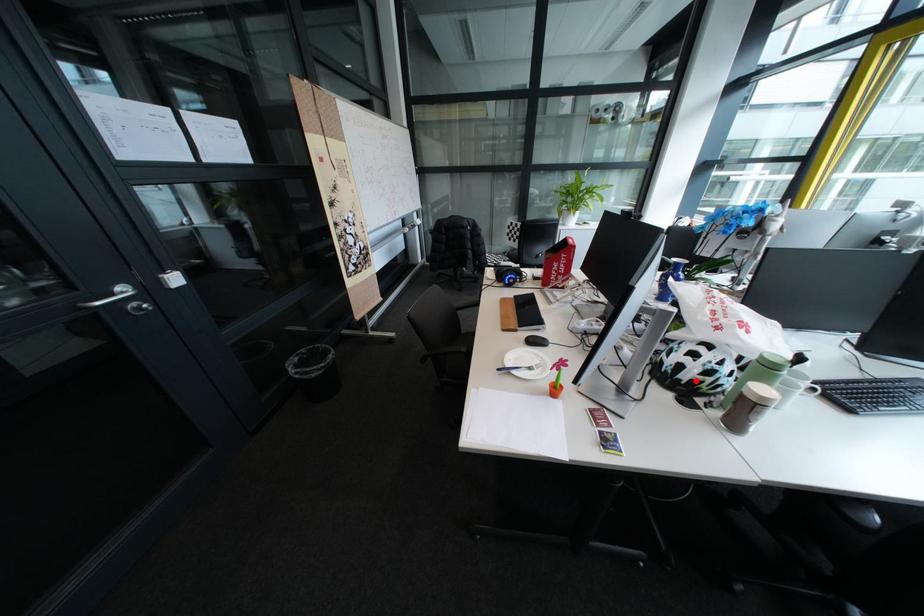
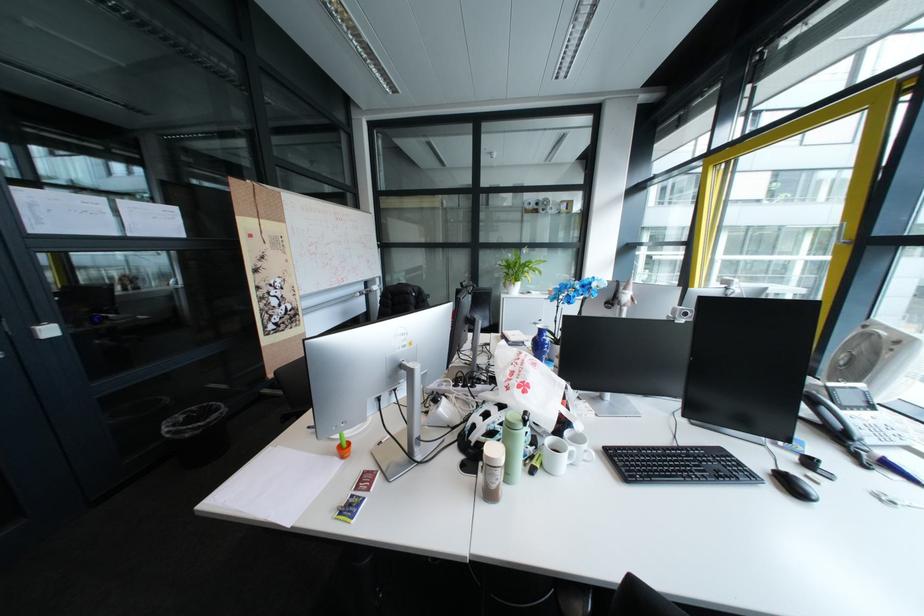
Where in the second image is the point corresponding to the highlighted location from the first image?

(484, 442)